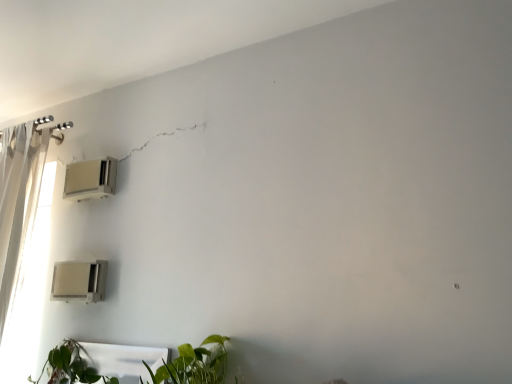
Question: From the image's perspective, does beige plastic air conditioner at lower left, the 2th air conditioning positioned from the top, appear higher than white plastic air conditioner at upper left, the 1th air conditioning positioned from the top?

Choices:
 (A) no
 (B) yes

Answer: (A)

Question: Is white plastic air conditioner at upper left, the 1th air conditioning positioned from the top, completely or partially inside beige plastic air conditioner at lower left, the 2th air conditioning positioned from the top?

Choices:
 (A) yes
 (B) no

Answer: (B)

Question: Considering the relative sizes of beige plastic air conditioner at lower left, the 2th air conditioning positioned from the top, and white plastic air conditioner at upper left, the 1th air conditioning positioned from the top, in the image provided, is beige plastic air conditioner at lower left, the 2th air conditioning positioned from the top, smaller than white plastic air conditioner at upper left, the 1th air conditioning positioned from the top,?

Choices:
 (A) no
 (B) yes

Answer: (A)

Question: From the image's perspective, is beige plastic air conditioner at lower left, arranged as the 1th air conditioning when ordered from the bottom, beneath white plastic air conditioner at upper left, the 1th air conditioning positioned from the top?

Choices:
 (A) yes
 (B) no

Answer: (A)

Question: Does beige plastic air conditioner at lower left, arranged as the 1th air conditioning when ordered from the bottom, have a lesser height compared to white plastic air conditioner at upper left, the 1th air conditioning positioned from the top?

Choices:
 (A) no
 (B) yes

Answer: (A)

Question: Is beige plastic air conditioner at lower left, arranged as the 1th air conditioning when ordered from the bottom, next to white plastic air conditioner at upper left, the 1th air conditioning positioned from the top?

Choices:
 (A) no
 (B) yes

Answer: (A)

Question: From a real-world perspective, is green leafy plant at lower center located higher than white plastic air conditioner at upper left, acting as the 2th air conditioning starting from the bottom?

Choices:
 (A) yes
 (B) no

Answer: (B)

Question: Are green leafy plant at lower center and white plastic air conditioner at upper left, acting as the 2th air conditioning starting from the bottom, located far from each other?

Choices:
 (A) yes
 (B) no

Answer: (B)

Question: From the image's perspective, is green leafy plant at lower center located beneath white plastic air conditioner at upper left, the 1th air conditioning positioned from the top?

Choices:
 (A) no
 (B) yes

Answer: (B)

Question: Is the position of green leafy plant at lower center more distant than that of white plastic air conditioner at upper left, acting as the 2th air conditioning starting from the bottom?

Choices:
 (A) no
 (B) yes

Answer: (A)

Question: Considering the relative sizes of green leafy plant at lower center and white plastic air conditioner at upper left, acting as the 2th air conditioning starting from the bottom, in the image provided, is green leafy plant at lower center taller than white plastic air conditioner at upper left, acting as the 2th air conditioning starting from the bottom,?

Choices:
 (A) yes
 (B) no

Answer: (B)

Question: Could you tell me if green leafy plant at lower center is turned towards white plastic air conditioner at upper left, the 1th air conditioning positioned from the top?

Choices:
 (A) no
 (B) yes

Answer: (A)

Question: Does white plastic air conditioner at upper left, the 1th air conditioning positioned from the top, have a lesser width compared to green leafy plant at lower center?

Choices:
 (A) yes
 (B) no

Answer: (A)